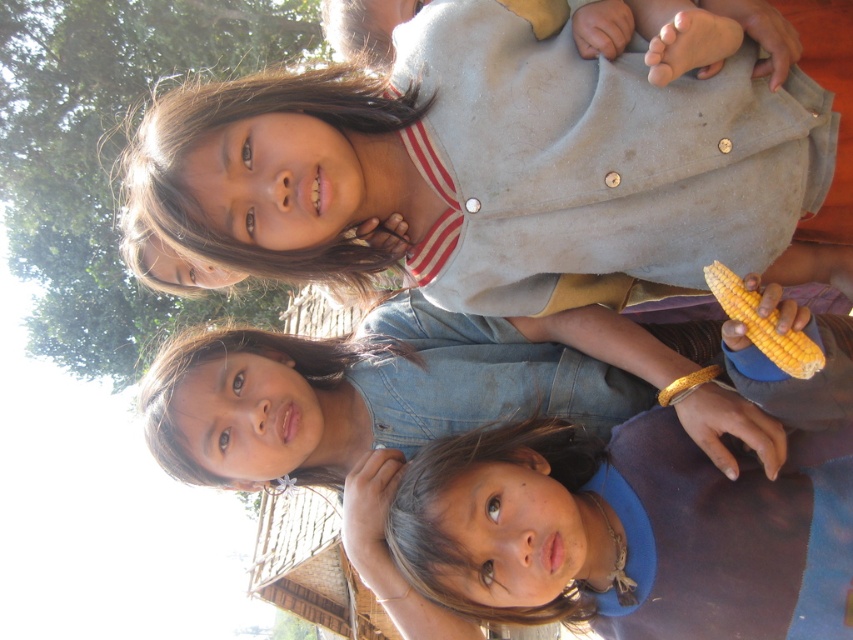
You are a photographer trying to capture a photo of the matte gray shirt at upper center and the yellow matte corn at right. Since you want both subjects to be in focus, you need to know which one is taller. Can you tell me which one is taller?

The matte gray shirt at upper center is taller than the yellow matte corn at right.

You are a photographer trying to capture a photo of the matte gray shirt at upper center and the yellow matte corn at right. Which object should you focus on first if you want to ensure both are in focus?

The matte gray shirt at upper center is bigger than the yellow matte corn at right, so focusing on the matte gray shirt at upper center first would help ensure both are in focus since it is larger and likely closer to the camera.

You are a photographer trying to capture a closeup of the corn cob held by the child at the top right. You notice two points marked in the image, point at (x=535, y=312) and point at (x=718, y=289). Which point is closer to your camera lens?

Point at (x=535, y=312) is closer to the camera lens than point at (x=718, y=289).